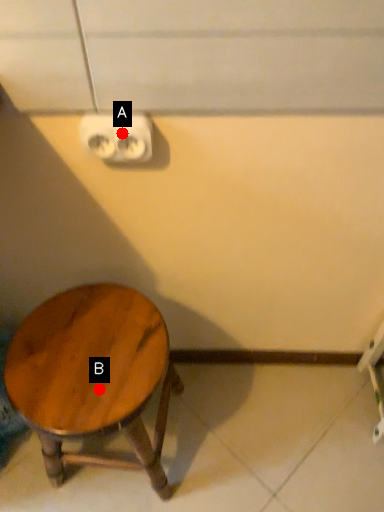
Question: Two points are circled on the image, labeled by A and B beside each circle. Which of the following is the farthest from the observer?

Choices:
 (A) A is further
 (B) B is further

Answer: (B)